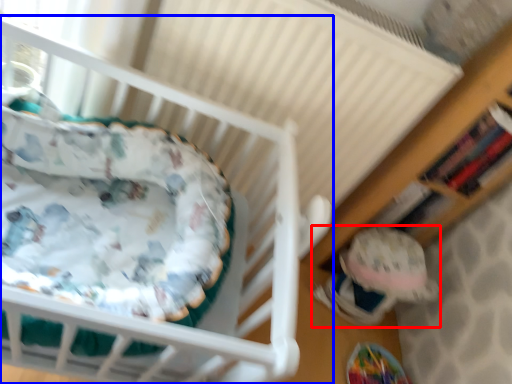
Question: Which point is closer to the camera, toy (highlighted by a red box) or infant bed (highlighted by a blue box)?

Choices:
 (A) toy
 (B) infant bed

Answer: (B)